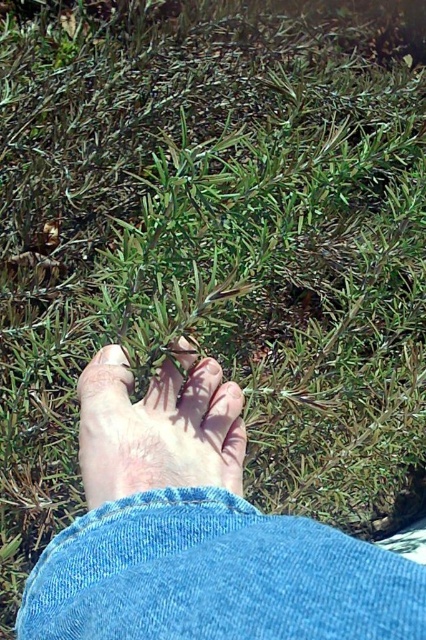
Question: Considering the relative positions of smooth skin foot at center and pale skin foot at center in the image provided, where is smooth skin foot at center located with respect to pale skin foot at center?

Choices:
 (A) right
 (B) left

Answer: (B)

Question: Among these objects, which one is nearest to the camera?

Choices:
 (A) pale skin foot at center
 (B) smooth skin foot at center

Answer: (B)

Question: Is smooth skin foot at center below pale skin foot at center?

Choices:
 (A) yes
 (B) no

Answer: (A)

Question: Does smooth skin foot at center lie behind pale skin foot at center?

Choices:
 (A) yes
 (B) no

Answer: (B)

Question: Which object appears closest to the camera in this image?

Choices:
 (A) smooth skin foot at center
 (B) pale skin foot at center

Answer: (A)

Question: Which point is closer to the camera?

Choices:
 (A) (181, 470)
 (B) (308, 557)

Answer: (B)